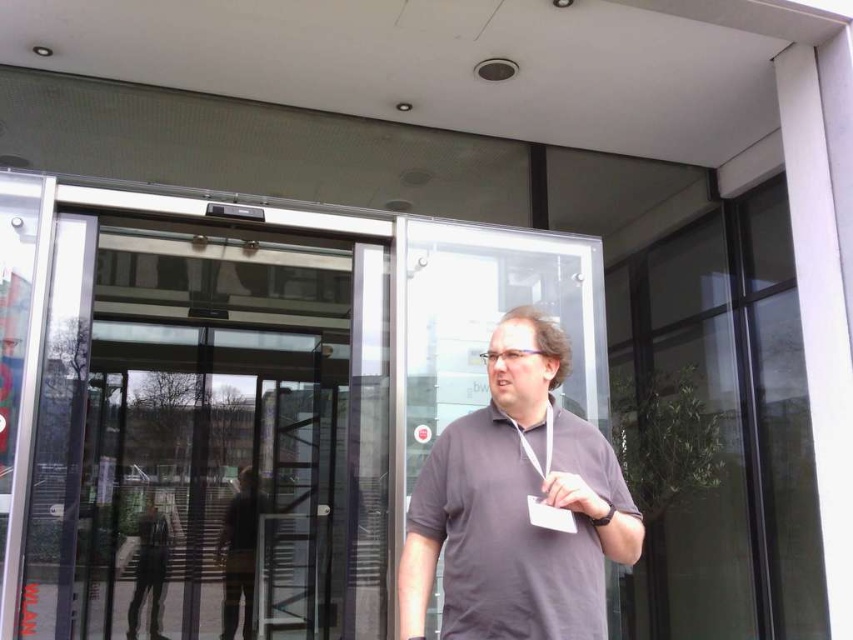
Is transparent glass door at center to the left of matte gray wristwatch at center from the viewer's perspective?

Indeed, transparent glass door at center is positioned on the left side of matte gray wristwatch at center.

Does transparent glass door at center have a greater width compared to matte gray wristwatch at center?

Yes, transparent glass door at center is wider than matte gray wristwatch at center.

Does point (115, 506) come closer to viewer compared to point (596, 518)?

No, (115, 506) is behind (596, 518).

You are a GUI agent. You are given a task and a screenshot of the screen. Output one action in this format:
    pyautogui.click(x=<x>, y=<y>)
    Task: Click on the transparent glass door at center
    The width and height of the screenshot is (853, 640).
    Given the screenshot: What is the action you would take?
    [204, 481]

Who is more distant from viewer, (525, 589) or (590, 492)?

The point (590, 492) is more distant.

Does gray matte shirt at center appear under matte gray wristwatch at center?

Incorrect, gray matte shirt at center is not positioned below matte gray wristwatch at center.

Between point (520, 541) and point (558, 476), which one is positioned in front?

Positioned in front is point (558, 476).

Locate an element on the screen. This screenshot has height=640, width=853. gray matte shirt at center is located at coordinates (514, 506).

Does point (154, 536) come in front of point (582, 516)?

That is False.

Does transparent glass door at center have a lesser width compared to gray matte shirt at center?

No.

Which is in front, point (96, 561) or point (550, 545)?

Point (550, 545)

Find the location of `transparent glass door at center`. transparent glass door at center is located at coordinates (204, 481).